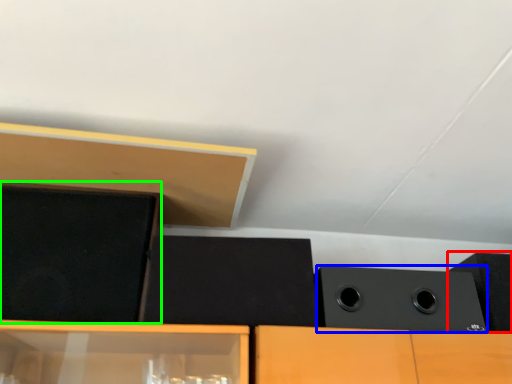
Question: Considering the real-world distances, which object is closest to speaker (highlighted by a red box)? speaker (highlighted by a blue box) or speaker (highlighted by a green box).

Choices:
 (A) speaker
 (B) speaker

Answer: (A)